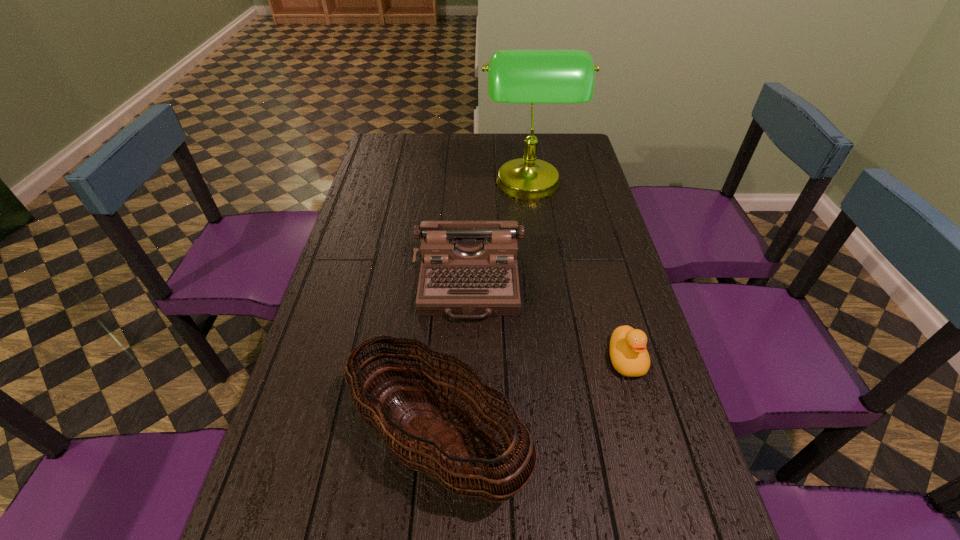
This screenshot has height=540, width=960. I want to click on the tallest object, so click(x=514, y=76).

Find the location of a particular element. lamp is located at coordinates (514, 76).

Where is `basket`? basket is located at coordinates (432, 441).

Identify the location of the third tallest object. Image resolution: width=960 pixels, height=540 pixels. (469, 270).

What are the coordinates of `the second farthest object` in the screenshot? It's located at (469, 270).

Image resolution: width=960 pixels, height=540 pixels. Find the location of `the shortest object`. the shortest object is located at coordinates (628, 353).

Identify the location of vacant space located 0.180m on the desk next to the farthest object. Image resolution: width=960 pixels, height=540 pixels. (433, 186).

You are a GUI agent. You are given a task and a screenshot of the screen. Output one action in this format:
    pyautogui.click(x=<x>, y=<y>)
    Task: Click on the free spot located on the desk next to the farthest object
    
    Given the screenshot: What is the action you would take?
    pyautogui.click(x=414, y=186)

Where is `vacant space situated 0.330m on the desk next to the farthest object`? The height and width of the screenshot is (540, 960). vacant space situated 0.330m on the desk next to the farthest object is located at coordinates (392, 186).

Where is `vacant area located on the left of the second tallest object`? This screenshot has height=540, width=960. vacant area located on the left of the second tallest object is located at coordinates (284, 442).